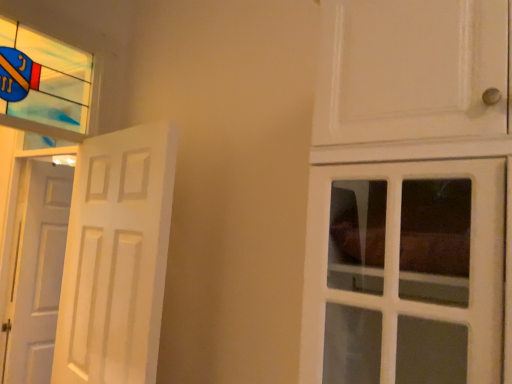
Question: Considering the relative positions of white matte door at left, the 1th door in the right-to-left sequence, and white matte door at left, arranged as the 1th door when viewed from the left, in the image provided, is white matte door at left, the 1th door in the right-to-left sequence, to the left or to the right of white matte door at left, arranged as the 1th door when viewed from the left,?

Choices:
 (A) left
 (B) right

Answer: (B)

Question: Choose the correct answer: Is white matte door at left, placed as the second door when sorted from left to right, inside white matte door at left, arranged as the 1th door when viewed from the left, or outside it?

Choices:
 (A) inside
 (B) outside

Answer: (B)

Question: Estimate the real-world distances between objects in this image. Which object is closer to the white matte door at left, the second door positioned from the right?

Choices:
 (A) stained glass window at upper left
 (B) white matte door at left, placed as the second door when sorted from left to right

Answer: (A)

Question: Which of these objects is positioned farthest from the white matte door at left, the 1th door in the right-to-left sequence?

Choices:
 (A) stained glass window at upper left
 (B) white matte door at left, arranged as the 1th door when viewed from the left

Answer: (B)